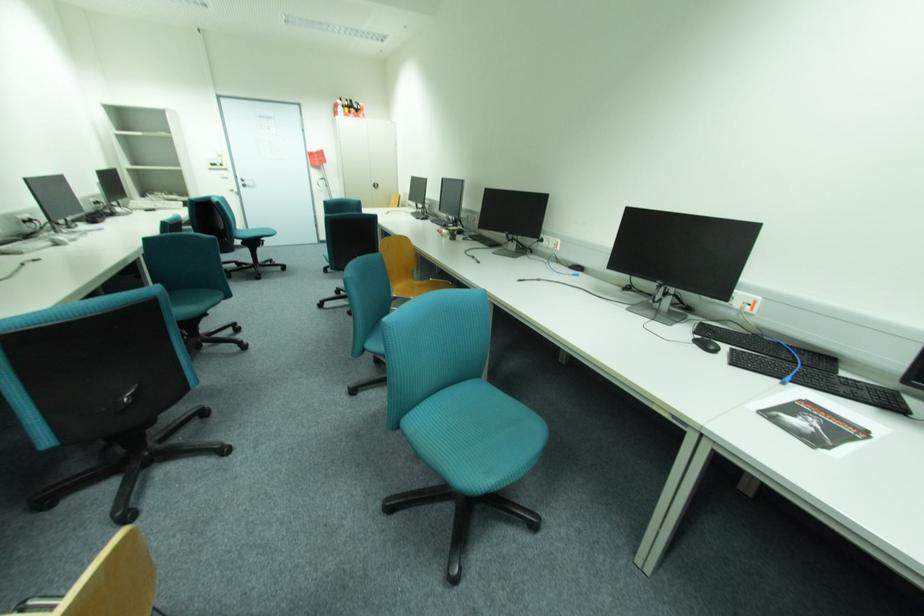
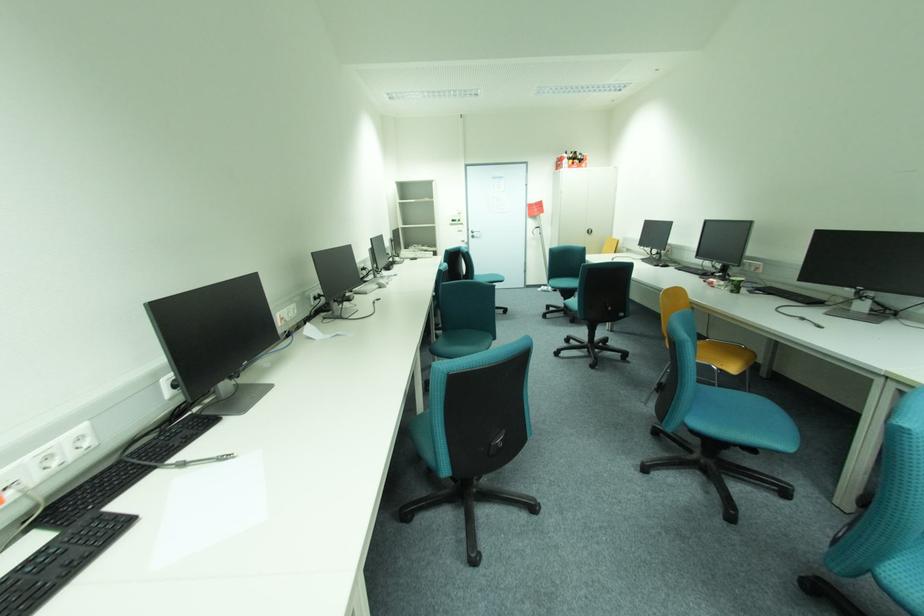
The point at (456, 238) is marked in the first image. Where is the corresponding point in the second image?

(738, 292)